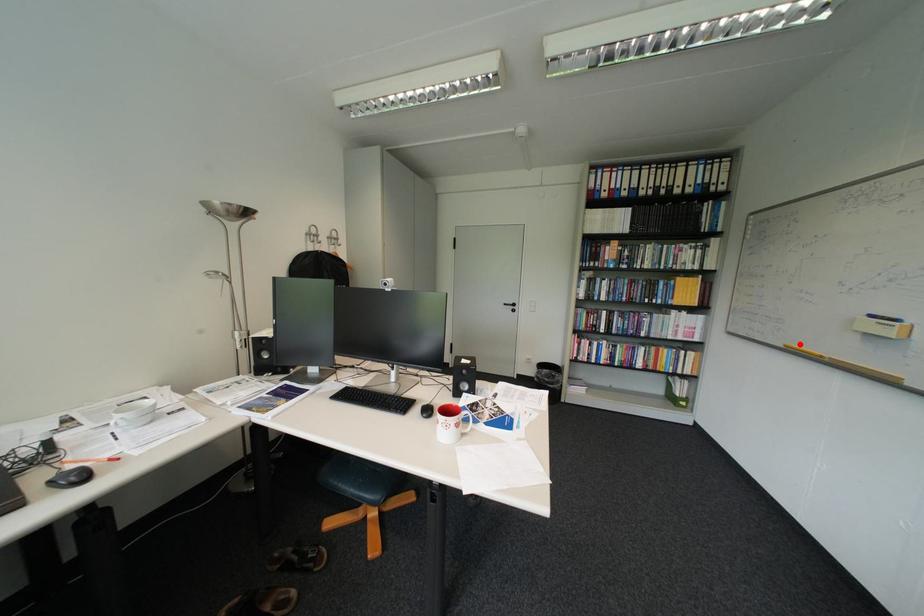
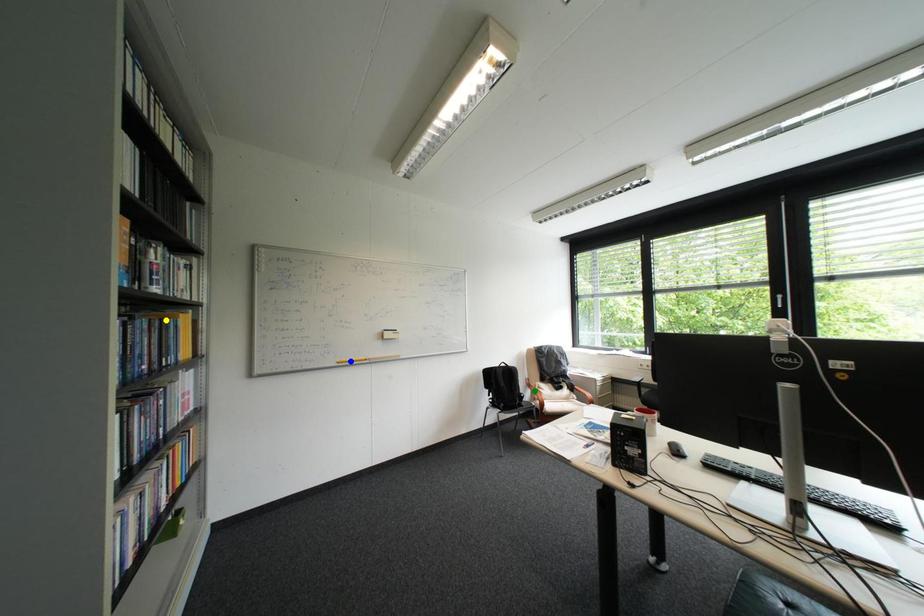
Question: I am providing you with two images of the same scene from different viewpoints. A red point is marked on the first image. You are given multiple points on the second image. Which spot in image 2 lines up with the point in image 1?

Choices:
 (A) yellow point
 (B) blue point
 (C) green point

Answer: (B)